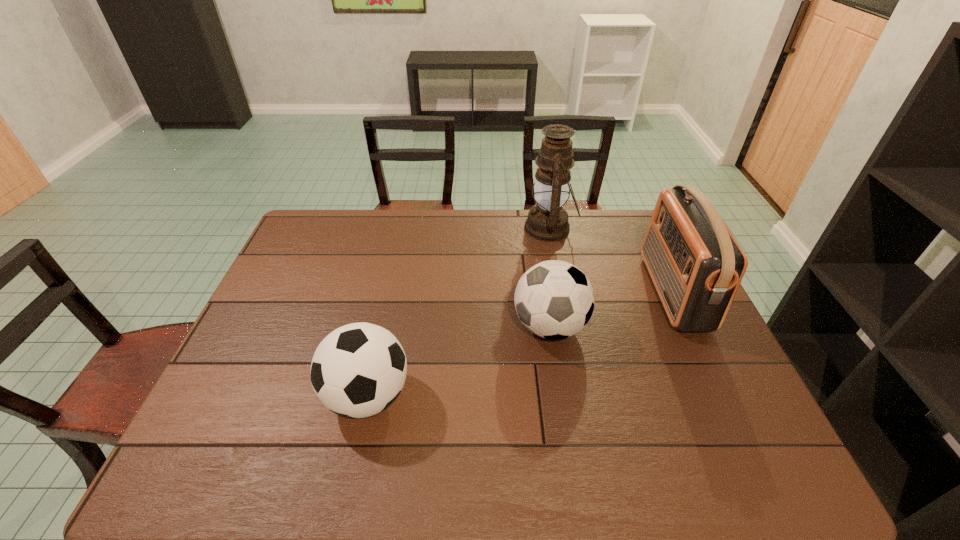
This screenshot has width=960, height=540. What are the coordinates of `the tallest object` in the screenshot? It's located at (547, 221).

Identify the location of the farthest object. The width and height of the screenshot is (960, 540). (x=547, y=221).

You are a GUI agent. You are given a task and a screenshot of the screen. Output one action in this format:
    pyautogui.click(x=<x>, y=<y>)
    Task: Click on the third shortest object
    
    Given the screenshot: What is the action you would take?
    pyautogui.click(x=696, y=264)

Find the location of a particular element. the rightmost object is located at coordinates (696, 264).

Where is `the nearest object`? The image size is (960, 540). the nearest object is located at coordinates (358, 370).

Locate an element on the screen. This screenshot has width=960, height=540. the nearer soccer ball is located at coordinates (358, 370).

This screenshot has height=540, width=960. What are the coordinates of `the right soccer ball` in the screenshot? It's located at (554, 299).

This screenshot has height=540, width=960. Find the location of `vacant space located on the front of the farthest object`. vacant space located on the front of the farthest object is located at coordinates (566, 310).

I want to click on free space located 0.200m on the front-facing side of the rightmost object, so click(x=588, y=292).

Locate an element on the screen. This screenshot has height=540, width=960. free region located on the front-facing side of the rightmost object is located at coordinates (624, 292).